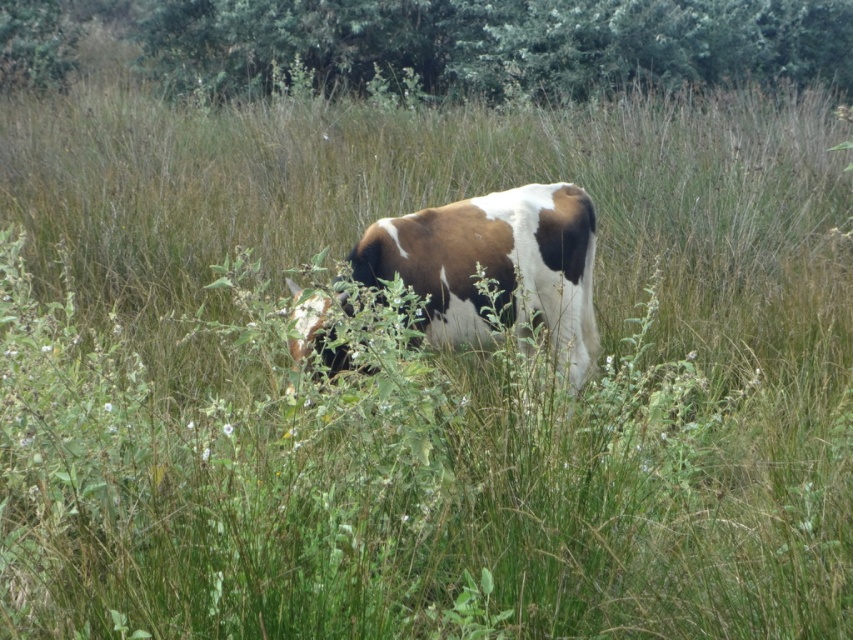
Question: Which point appears farthest from the camera in this image?

Choices:
 (A) (543, 218)
 (B) (335, 76)

Answer: (B)

Question: Which point is closer to the camera?

Choices:
 (A) (612, 22)
 (B) (436, 298)

Answer: (B)

Question: Can you confirm if green leafy tree at upper center is positioned to the left of brown and white fur at center?

Choices:
 (A) yes
 (B) no

Answer: (A)

Question: Does green leafy tree at upper center appear over brown and white fur at center?

Choices:
 (A) no
 (B) yes

Answer: (B)

Question: Is green leafy tree at upper center below brown and white fur at center?

Choices:
 (A) no
 (B) yes

Answer: (A)